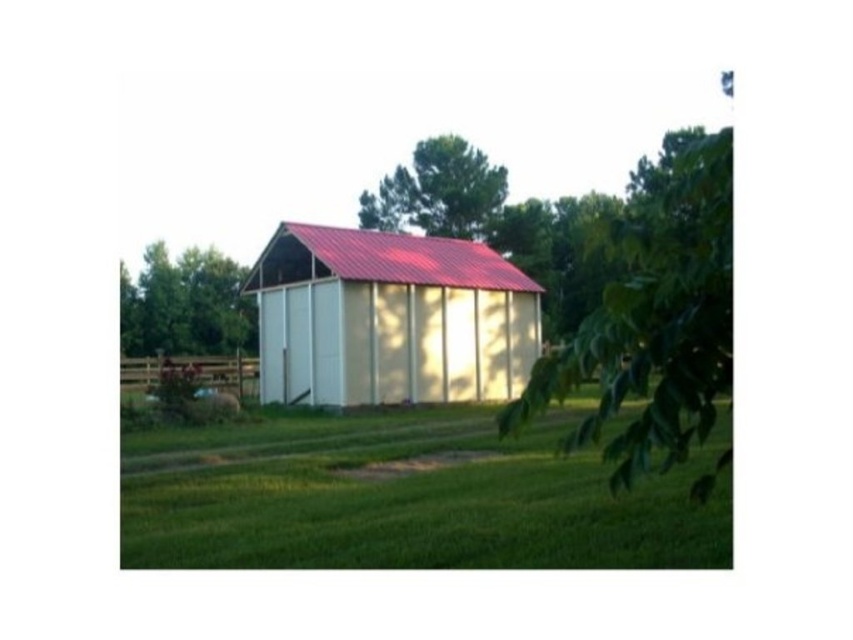
Question: Does metallic white barn at center have a smaller size compared to green leafy tree at left?

Choices:
 (A) no
 (B) yes

Answer: (B)

Question: Which object appears closest to the camera in this image?

Choices:
 (A) green leafy tree at left
 (B) green leafy tree at upper center

Answer: (B)

Question: Which point is closer to the camera?

Choices:
 (A) metallic white barn at center
 (B) green leafy tree at center
 (C) green leafy tree at left

Answer: (B)

Question: Which object is positioned closest to the green leafy tree at center?

Choices:
 (A) metallic white barn at center
 (B) green leafy tree at upper center
 (C) green leafy tree at left

Answer: (A)

Question: Can you confirm if green grass at lower center is bigger than green leafy tree at upper center?

Choices:
 (A) no
 (B) yes

Answer: (A)

Question: Is green grass at lower center bigger than metallic white barn at center?

Choices:
 (A) yes
 (B) no

Answer: (B)